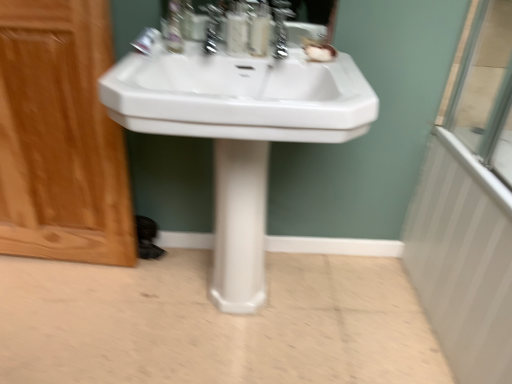
At what (x,y) coordinates should I click in order to perform the action: click on vacant area that lies between wooden screen door at left and white glossy pedestal at center. Please return your answer as a coordinate pair (x, y). Looking at the image, I should click on (151, 283).